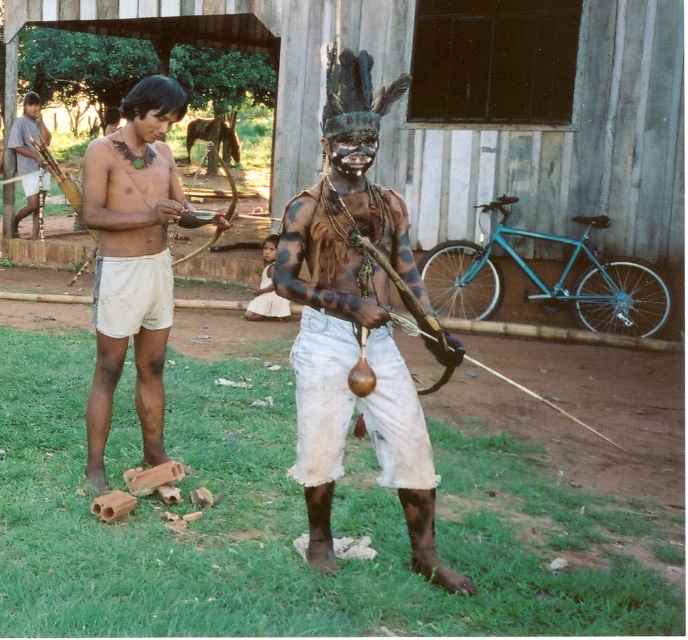
You are an anthropologist observing this scene. You notice the matte white shorts at center and the matte brown wooden stick at left. Which object is positioned more to the left?

The matte brown wooden stick at left is positioned more to the left than the matte white shorts at center.

You are a photographer trying to capture the scene. You notice the matte white shorts at center and the matte brown wooden stick at left. Which object should you focus on first if you want to capture both in a single frame without moving the camera?

The matte brown wooden stick at left should be focused on first because it is higher up and the matte white shorts at center is located below it, allowing both to be in the same frame by adjusting focus from top to bottom.